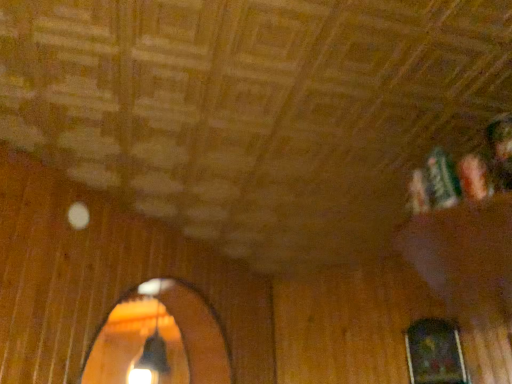
Describe the element at coordinates (435, 353) in the screenshot. I see `matte glass window at lower right` at that location.

Identify the location of matte glass window at lower right. (435, 353).

Identify the location of matte glass window at lower right. click(435, 353).